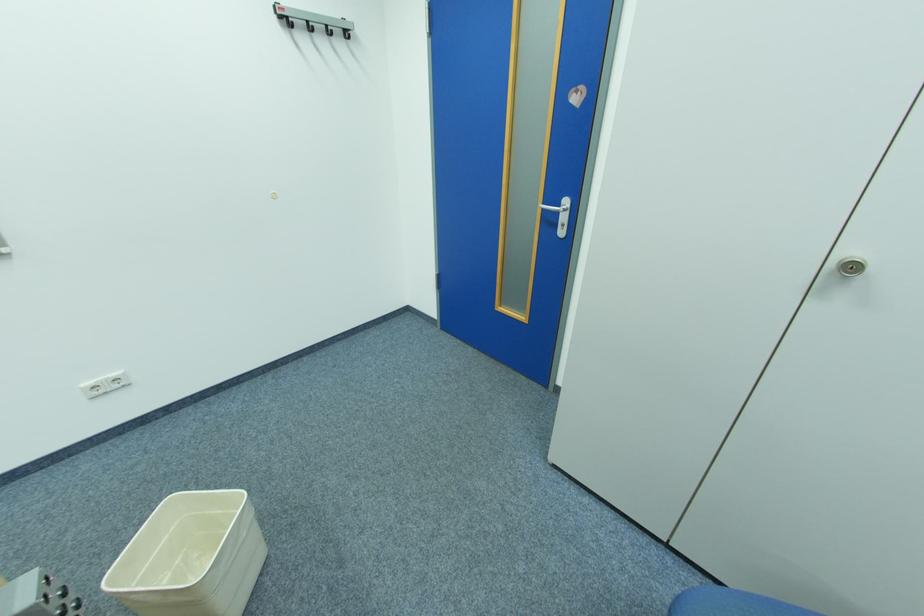
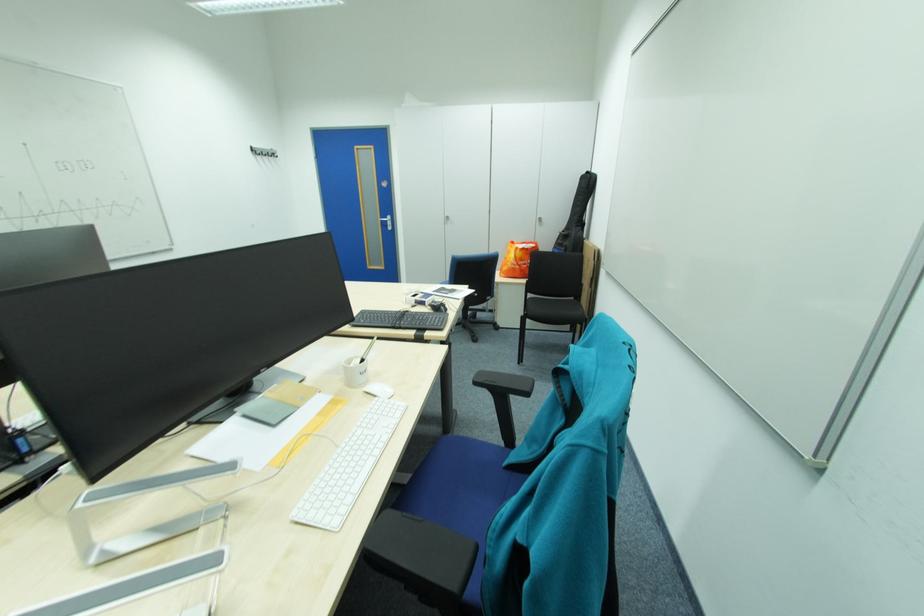
The point at (552,209) is marked in the first image. Where is the corresponding point in the second image?

(390, 221)